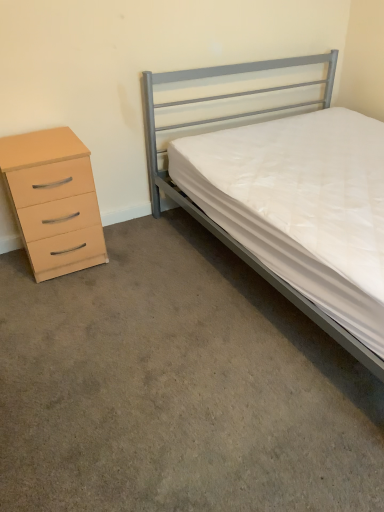
Identify the location of vacant area to the right of beige matte chest of drawers at left. The height and width of the screenshot is (512, 384). click(x=133, y=253).